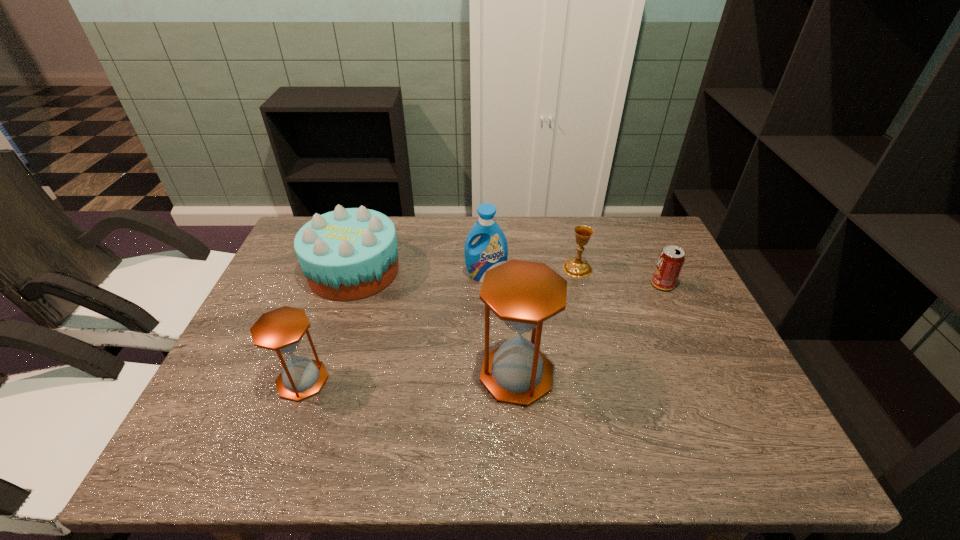
This screenshot has height=540, width=960. What are the coordinates of `vacant space located 0.390m on the front of the chalice` in the screenshot? It's located at (610, 394).

The image size is (960, 540). In order to click on free space located 0.360m on the right of the cake in this screenshot , I will do `click(523, 271)`.

You are a GUI agent. You are given a task and a screenshot of the screen. Output one action in this format:
    pyautogui.click(x=<x>, y=<y>)
    Task: Click on the vacant space situated 0.350m on the left of the soda can
    The image size is (960, 540).
    Given the screenshot: What is the action you would take?
    pyautogui.click(x=527, y=285)

Identify the location of vacant space situated 0.140m on the front-facing side of the fifth shortest object. (487, 319).

This screenshot has height=540, width=960. I want to click on chalice at the far edge, so click(x=575, y=267).

Where is `cake situated at the far edge`? cake situated at the far edge is located at coordinates (348, 254).

Identify the location of hourglass located in the left edge section of the desktop. (281, 330).

Find the location of a particular element. cake situated at the left edge is located at coordinates (348, 254).

I want to click on object positioned at the right edge, so click(671, 259).

You are a GUI agent. You are given a task and a screenshot of the screen. Output one action in this format:
    pyautogui.click(x=<x>, y=<y>)
    Task: Click on the object located in the far left corner section of the desktop
    
    Given the screenshot: What is the action you would take?
    pyautogui.click(x=348, y=254)